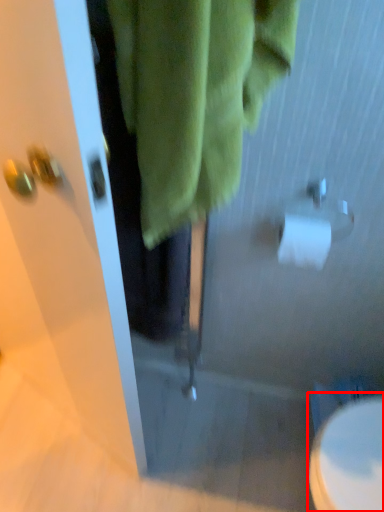
Question: Where is toilet (annotated by the red box) located in relation to toilet paper in the image?

Choices:
 (A) left
 (B) right

Answer: (B)